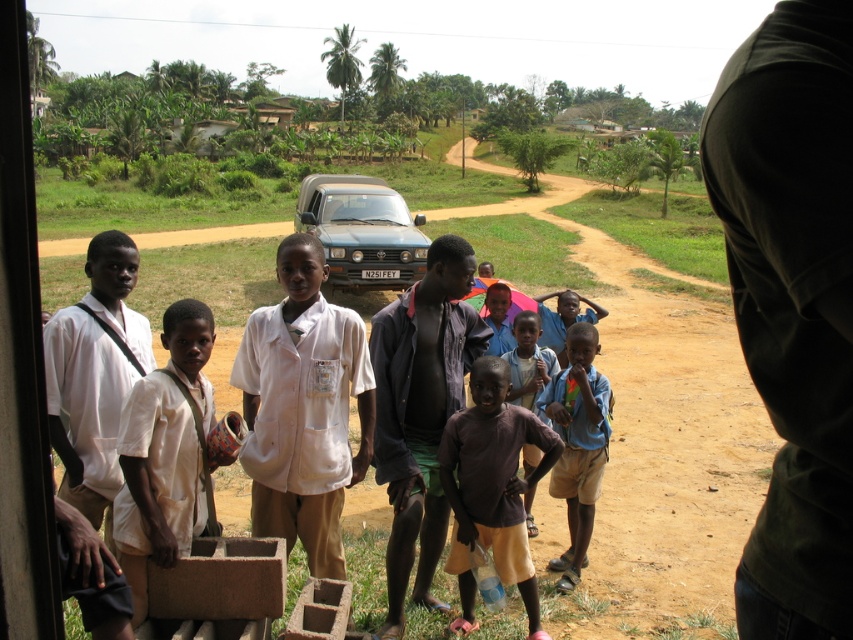
Measure the distance between point (515, 522) and camera.

Point (515, 522) and camera are 4.29 meters apart.

Does brown matte shirt at center have a greater width compared to light brown skin at center?

Correct, the width of brown matte shirt at center exceeds that of light brown skin at center.

Locate an element on the screen. The image size is (853, 640). brown matte shirt at center is located at coordinates (491, 486).

This screenshot has width=853, height=640. In order to click on brown matte shirt at center in this screenshot , I will do `click(491, 486)`.

Does point (90, 369) come behind point (512, 356)?

No.

Who is taller, white matte shirt at left or light brown skin at center?

white matte shirt at left is taller.

Between point (73, 486) and point (532, 465), which one is positioned behind?

Positioned behind is point (532, 465).

What are the coordinates of `white matte shirt at left` in the screenshot? It's located at click(94, 376).

Who is lower down, dark green shirt at right or dark brown fabric shirt at center?

Positioned lower is dark brown fabric shirt at center.

Does dark green shirt at right have a lesser width compared to dark brown fabric shirt at center?

Indeed, dark green shirt at right has a lesser width compared to dark brown fabric shirt at center.

Identify the location of dark green shirt at right. The image size is (853, 640). (792, 301).

Where is `dark green shirt at right`? Image resolution: width=853 pixels, height=640 pixels. dark green shirt at right is located at coordinates (792, 301).